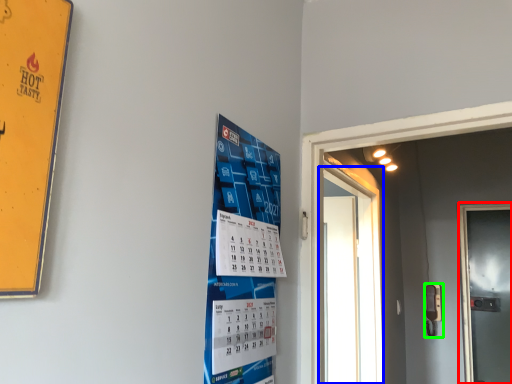
Question: Which object is positioned farthest from door (highlighted by a red box)? Select from door (highlighted by a blue box) and door handle (highlighted by a green box).

Choices:
 (A) door
 (B) door handle

Answer: (A)